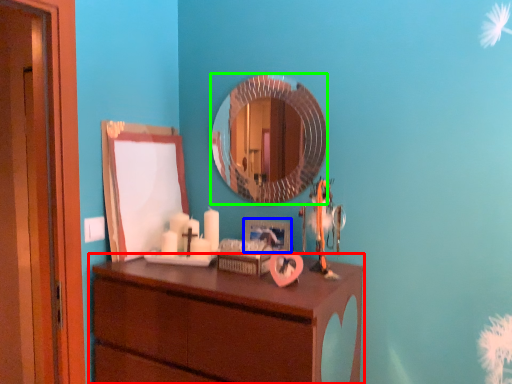
Question: Which is nearer to the chest of drawers (highlighted by a red box)? picture frame (highlighted by a blue box) or mirror (highlighted by a green box).

Choices:
 (A) picture frame
 (B) mirror

Answer: (A)